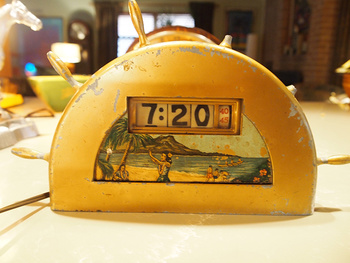
This screenshot has height=263, width=350. I want to click on time display, so click(x=138, y=112).